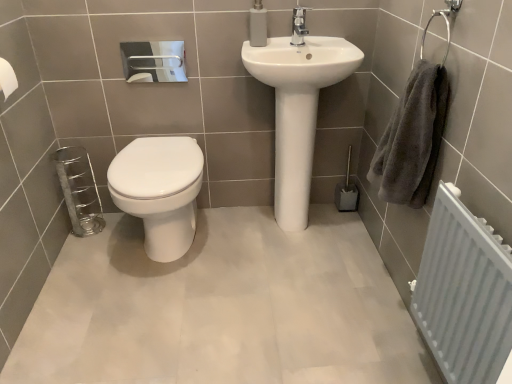
This screenshot has height=384, width=512. What are the coordinates of `polished chrome faucet at upper center` in the screenshot? It's located at (298, 26).

You are a GUI agent. You are given a task and a screenshot of the screen. Output one action in this format:
    pyautogui.click(x=<x>, y=<y>)
    Task: Click on the white glossy sink at center
    
    Given the screenshot: What is the action you would take?
    pyautogui.click(x=296, y=106)

Describe the element at coordinates (7, 78) in the screenshot. The width and height of the screenshot is (512, 384). I see `white matte toilet paper at left` at that location.

This screenshot has width=512, height=384. What do you see at coordinates (159, 191) in the screenshot?
I see `white glossy toilet at center` at bounding box center [159, 191].

The width and height of the screenshot is (512, 384). Find the location of `white glossy toilet at center`. white glossy toilet at center is located at coordinates (159, 191).

Where is `polished chrome faucet at upper center`? polished chrome faucet at upper center is located at coordinates (298, 26).

Looking at this image, is polished chrome faucet at upper center positioned far away from white glossy sink at center?

That's not correct — polished chrome faucet at upper center is a little close to white glossy sink at center.

From a real-world perspective, between polished chrome faucet at upper center and white glossy sink at center, who is vertically higher?

polished chrome faucet at upper center.

Is polished chrome faucet at upper center completely or partially outside of white glossy sink at center?

Absolutely, polished chrome faucet at upper center is external to white glossy sink at center.

Could you tell me if polished chrome faucet at upper center is facing white glossy sink at center?

No.

What's the angular difference between polished chrome faucet at upper center and white matte toilet paper at left's facing directions?

The facing directions of polished chrome faucet at upper center and white matte toilet paper at left are 90.9 degrees apart.

Where is `toilet paper located below the polished chrome faucet at upper center (from the image's perspective)`? The width and height of the screenshot is (512, 384). toilet paper located below the polished chrome faucet at upper center (from the image's perspective) is located at coordinates (7, 78).

Is polished chrome faucet at upper center to the left of white matte toilet paper at left from the viewer's perspective?

No.

Is white matte toilet paper at left inside polished chrome faucet at upper center?

No, white matte toilet paper at left is not inside polished chrome faucet at upper center.

Which of these two, gray fluffy towel at right or white glossy toilet at center, stands shorter?

white glossy toilet at center is shorter.

Measure the distance between gray fluffy towel at right and white glossy toilet at center.

They are 32.00 inches apart.

Can you confirm if gray fluffy towel at right is wider than white glossy toilet at center?

A: Incorrect, the width of gray fluffy towel at right does not surpass that of white glossy toilet at center.

In the image, there is a white matte toilet paper at left. At what (x,y) coordinates should I click in order to perform the action: click on toilet below it (from a real-world perspective). Please return your answer as a coordinate pair (x, y). Looking at the image, I should click on (159, 191).

Considering the sizes of white glossy toilet at center and white matte toilet paper at left in the image, is white glossy toilet at center bigger or smaller than white matte toilet paper at left?

Clearly, white glossy toilet at center is larger in size than white matte toilet paper at left.

Is white glossy toilet at center in contact with white matte toilet paper at left?

white glossy toilet at center and white matte toilet paper at left are clearly separated.

From a real-world perspective, who is located lower, white glossy toilet at center or white matte toilet paper at left?

In real-world perspective, white glossy toilet at center is lower.

Who is shorter, white textured radiator at right or polished chrome faucet at upper center?

Standing shorter between the two is polished chrome faucet at upper center.

Would you say white textured radiator at right is outside polished chrome faucet at upper center?

Yes, white textured radiator at right is not within polished chrome faucet at upper center.

Is white textured radiator at right looking in the opposite direction of polished chrome faucet at upper center?

No.

Is white textured radiator at right in contact with polished chrome faucet at upper center?

There is a gap between white textured radiator at right and polished chrome faucet at upper center.

Consider the image. Does gray fluffy towel at right have a greater height compared to white glossy sink at center?

No.

Is gray fluffy towel at right in front of or behind white glossy sink at center in the image?

In the image, gray fluffy towel at right appears in front of white glossy sink at center.

Is gray fluffy towel at right with white glossy sink at center?

There is a gap between gray fluffy towel at right and white glossy sink at center.

Is gray fluffy towel at right bigger than white glossy sink at center?

Incorrect, gray fluffy towel at right is not larger than white glossy sink at center.

I want to click on toilet paper on the left of white textured radiator at right, so click(7, 78).

From a real-world perspective, who is located lower, white matte toilet paper at left or white textured radiator at right?

white textured radiator at right.

Based on the photo, from the image's perspective, is white matte toilet paper at left located above white textured radiator at right?

Yes, from the image's perspective, white matte toilet paper at left is on top of white textured radiator at right.

Is white textured radiator at right a part of white matte toilet paper at left?

No, white textured radiator at right is located outside of white matte toilet paper at left.

You are a GUI agent. You are given a task and a screenshot of the screen. Output one action in this format:
    pyautogui.click(x=<x>, y=<y>)
    Task: Click on the sink to the left of polished chrome faucet at upper center
    
    Given the screenshot: What is the action you would take?
    pyautogui.click(x=296, y=106)

The height and width of the screenshot is (384, 512). I want to click on tap on the right of white matte toilet paper at left, so tap(298, 26).

Estimate the real-world distances between objects in this image. Which object is further from gray fluffy towel at right, white glossy toilet at center or white glossy sink at center?

white glossy toilet at center.

Which object lies further to the anchor point white glossy sink at center, white matte toilet paper at left or white textured radiator at right?

Based on the image, white matte toilet paper at left appears to be further to white glossy sink at center.

Looking at this image, estimate the real-world distances between objects in this image. Which object is closer to polished chrome faucet at upper center, white glossy toilet at center or white glossy sink at center?

The object closer to polished chrome faucet at upper center is white glossy sink at center.

Considering their positions, is white textured radiator at right positioned further to polished chrome faucet at upper center than white glossy toilet at center?

Among the two, white textured radiator at right is located further to polished chrome faucet at upper center.

Considering their positions, is white matte toilet paper at left positioned further to white textured radiator at right than white glossy toilet at center?

white matte toilet paper at left is positioned further to the anchor white textured radiator at right.

From the image, which object appears to be farther from white glossy toilet at center, polished chrome faucet at upper center or white textured radiator at right?

Among the two, white textured radiator at right is located further to white glossy toilet at center.

When comparing their distances from white glossy toilet at center, does white textured radiator at right or gray fluffy towel at right seem further?

Among the two, white textured radiator at right is located further to white glossy toilet at center.

From the image, which object appears to be farther from polished chrome faucet at upper center, white glossy sink at center or white glossy toilet at center?

white glossy toilet at center is further to polished chrome faucet at upper center.

At what (x,y) coordinates should I click in order to perform the action: click on sink situated between white matte toilet paper at left and white textured radiator at right from left to right. Please return your answer as a coordinate pair (x, y). The height and width of the screenshot is (384, 512). Looking at the image, I should click on (296, 106).

Where is `sink between polished chrome faucet at upper center and gray fluffy towel at right from top to bottom`? sink between polished chrome faucet at upper center and gray fluffy towel at right from top to bottom is located at coordinates coord(296,106).

Locate an element on the screen. Image resolution: width=512 pixels, height=384 pixels. sink that lies between polished chrome faucet at upper center and white glossy toilet at center from top to bottom is located at coordinates (296, 106).

The image size is (512, 384). Identify the location of sink between polished chrome faucet at upper center and white textured radiator at right vertically. (296, 106).